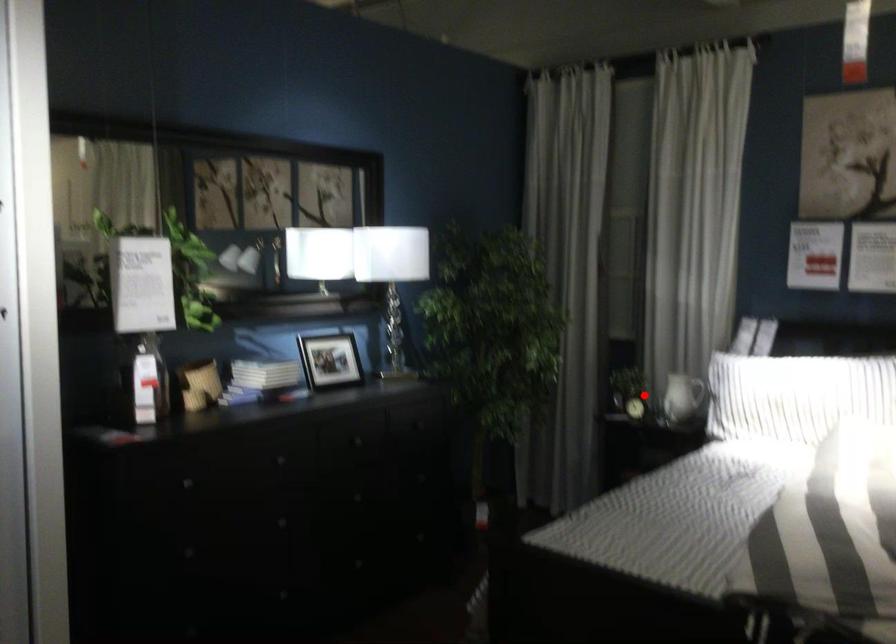
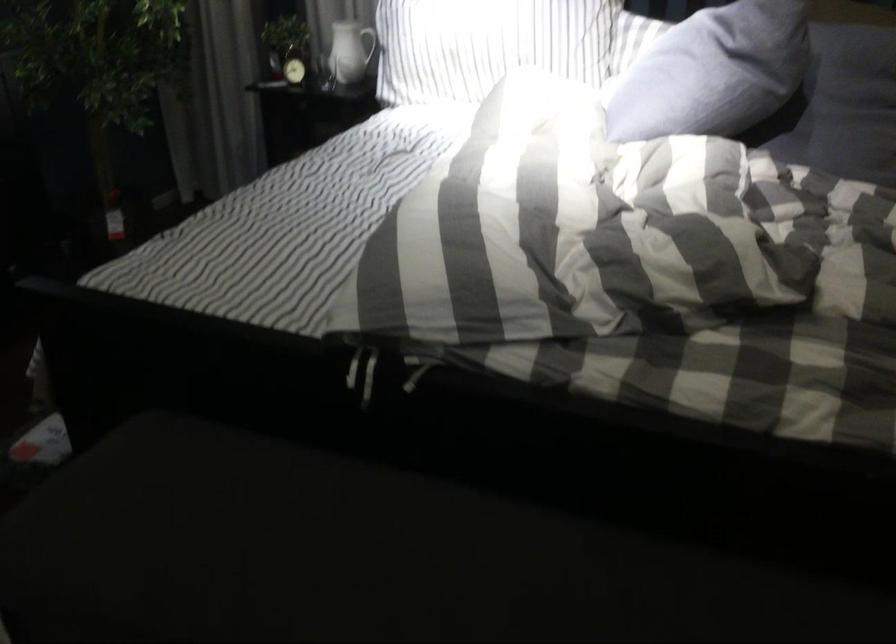
Where in the second image is the point corresponding to the highlighted location from the first image?

(294, 62)